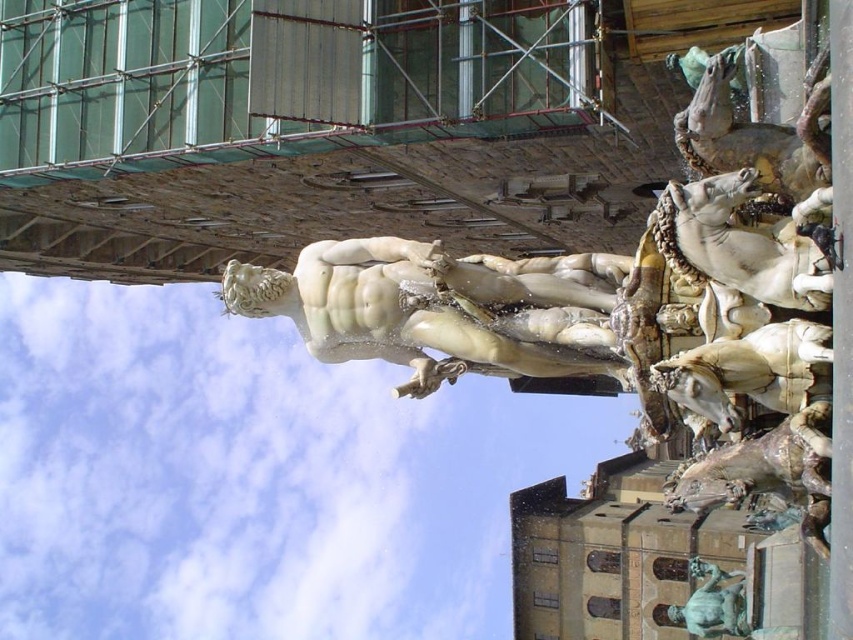
You are a tourist standing in front of the fountain and want to take a photo that includes both the white marble statue at center and the bronze statue at lower right. Based on their positions, which statue should you focus on first to ensure both are in the frame?

The white marble statue at center is located above the bronze statue at lower right, so you should focus on the bronze statue at lower right first to ensure both are in the frame.